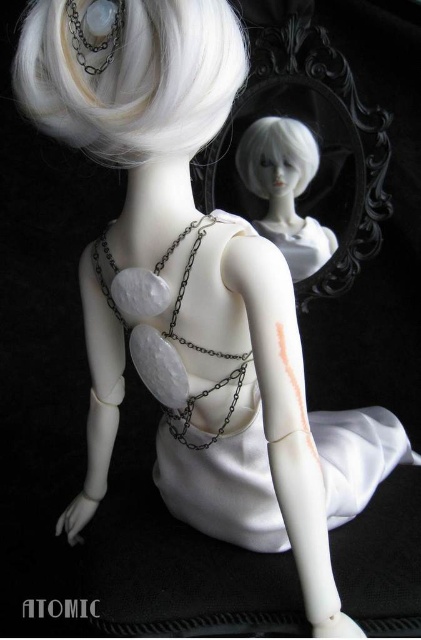
Which is in front, point (106, 44) or point (268, 214)?

Point (106, 44) is more forward.

Image resolution: width=421 pixels, height=640 pixels. I want to click on white matte wig at upper left, so click(130, 74).

Which is more to the left, white matte doll head at upper center or white matte wig at upper center?

From the viewer's perspective, white matte wig at upper center appears more on the left side.

Consider the image. Does white matte doll head at upper center come in front of white matte wig at upper center?

No.

The image size is (421, 640). I want to click on white matte doll head at upper center, so click(285, 189).

Measure the distance between point (149, 352) and camera.

31.30 inches

Is point (165, 253) farther from viewer compared to point (280, 156)?

No, (165, 253) is in front of (280, 156).

Locate an element on the screen. matte silver chain at center is located at coordinates [164, 333].